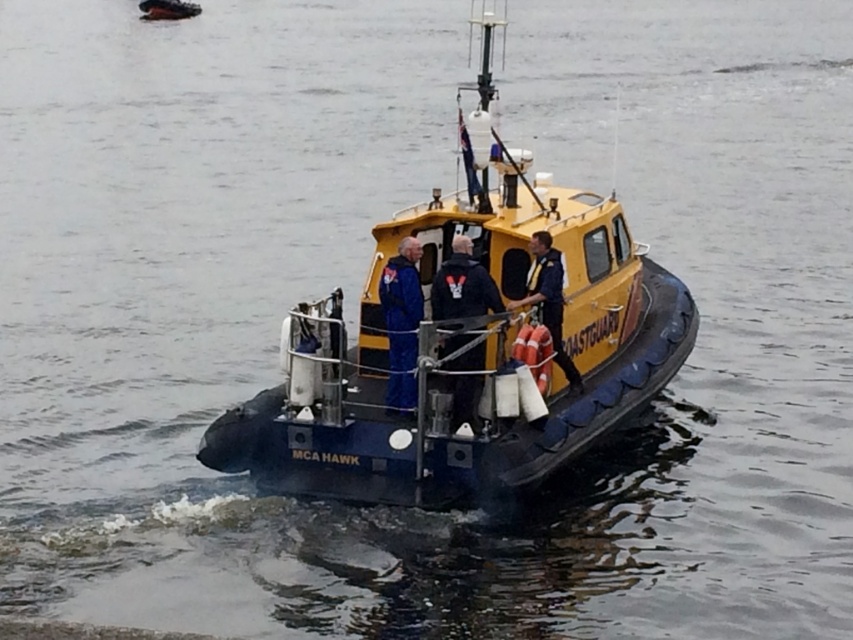
Does yellow rubber life jacket at center come behind orange fabric life jacket at center?

Yes, yellow rubber life jacket at center is further from the viewer.

At what (x,y) coordinates should I click in order to perform the action: click on yellow rubber life jacket at center. Please return your answer as a coordinate pair (x, y). This screenshot has width=853, height=640. Looking at the image, I should click on (549, 300).

Where is `yellow rubber boat at center`? Image resolution: width=853 pixels, height=640 pixels. yellow rubber boat at center is located at coordinates (463, 348).

Which is above, yellow rubber boat at center or yellow rubber life jacket at center?

yellow rubber boat at center is above.

Is point (589, 196) less distant than point (560, 300)?

No.

You are a GUI agent. You are given a task and a screenshot of the screen. Output one action in this format:
    pyautogui.click(x=<x>, y=<y>)
    Task: Click on the yellow rubber boat at center
    This screenshot has width=853, height=640.
    Given the screenshot: What is the action you would take?
    pyautogui.click(x=463, y=348)

Can you confirm if yellow rubber boat at center is wider than orange fabric life jacket at center?

Correct, the width of yellow rubber boat at center exceeds that of orange fabric life jacket at center.

Which is behind, point (514, 211) or point (517, 353)?

The point (514, 211) is behind.

Which is in front, point (329, 340) or point (541, 340)?

Point (541, 340) is in front.

At what (x,y) coordinates should I click in order to perform the action: click on yellow rubber boat at center. Please return your answer as a coordinate pair (x, y). Image resolution: width=853 pixels, height=640 pixels. Looking at the image, I should click on (463, 348).